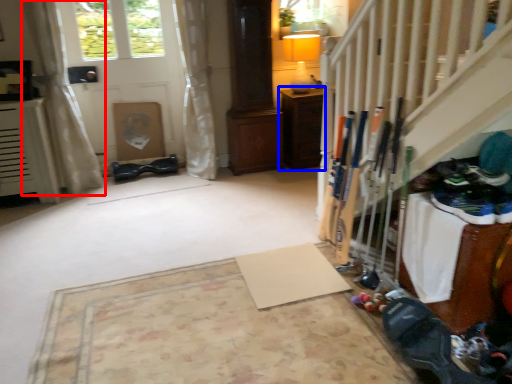
Question: Which of the following is the closest to the observer, curtain (highlighted by a red box) or furniture (highlighted by a blue box)?

Choices:
 (A) curtain
 (B) furniture

Answer: (A)